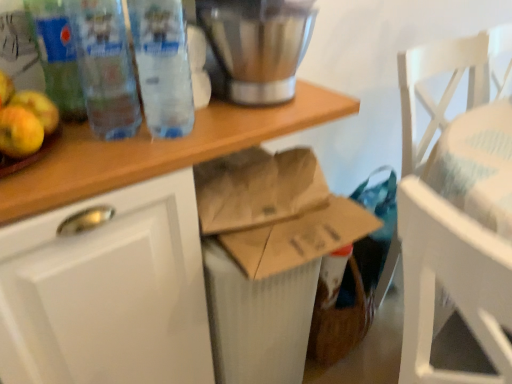
Question: Is stainless steel blender at upper center oriented towards yellow matte apple at left?

Choices:
 (A) no
 (B) yes

Answer: (A)

Question: Is yellow matte apple at left inside stainless steel blender at upper center?

Choices:
 (A) yes
 (B) no

Answer: (B)

Question: Is stainless steel blender at upper center behind yellow matte apple at left?

Choices:
 (A) no
 (B) yes

Answer: (B)

Question: Considering the relative positions of stainless steel blender at upper center and yellow matte apple at left in the image provided, is stainless steel blender at upper center in front of yellow matte apple at left?

Choices:
 (A) no
 (B) yes

Answer: (A)

Question: Is stainless steel blender at upper center facing away from yellow matte apple at left?

Choices:
 (A) yes
 (B) no

Answer: (B)

Question: Is stainless steel blender at upper center not within yellow matte apple at left?

Choices:
 (A) yes
 (B) no

Answer: (A)

Question: From a real-world perspective, is yellow matte apple at left physically above brown paper bag at center?

Choices:
 (A) yes
 (B) no

Answer: (A)

Question: Is yellow matte apple at left facing towards brown paper bag at center?

Choices:
 (A) no
 (B) yes

Answer: (A)

Question: Can you confirm if yellow matte apple at left is taller than brown paper bag at center?

Choices:
 (A) yes
 (B) no

Answer: (B)

Question: Does yellow matte apple at left appear on the right side of brown paper bag at center?

Choices:
 (A) yes
 (B) no

Answer: (B)

Question: From the image's perspective, would you say yellow matte apple at left is shown under brown paper bag at center?

Choices:
 (A) yes
 (B) no

Answer: (B)

Question: Is yellow matte apple at left smaller than brown paper bag at center?

Choices:
 (A) yes
 (B) no

Answer: (A)

Question: Does yellow matte apple at left have a smaller size compared to transparent plastic bottles at upper left, arranged as the 1th bottle when viewed from the right?

Choices:
 (A) yes
 (B) no

Answer: (A)